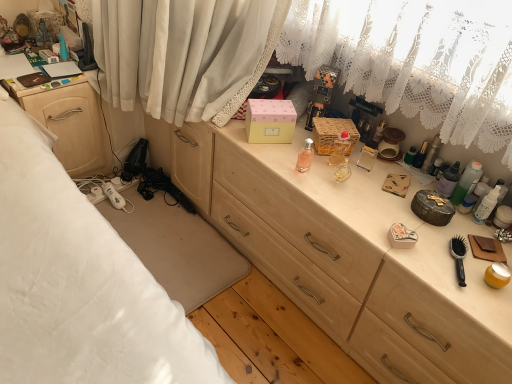
Locate an element on the screen. The width and height of the screenshot is (512, 384). blank area to the left of pink glass perfume at center, the first toiletry in the left-to-right sequence is located at coordinates (259, 150).